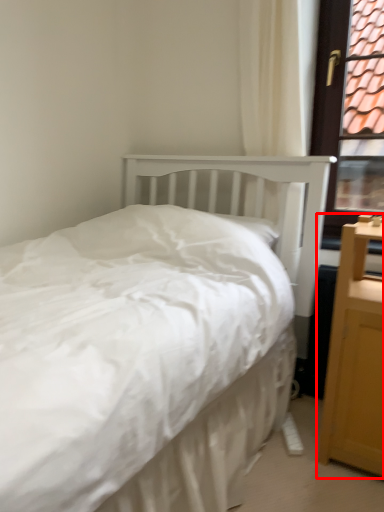
Question: From the image's perspective, where is nightstand (annotated by the red box) located in relation to window frame in the image?

Choices:
 (A) below
 (B) above

Answer: (A)